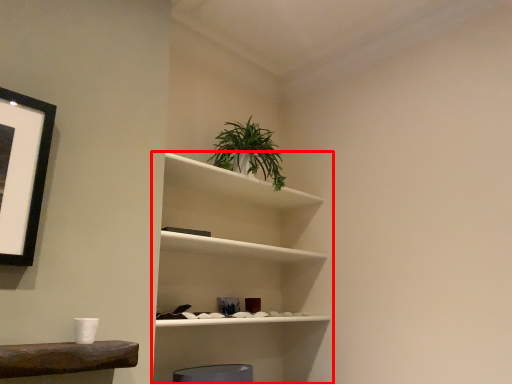
Question: From the image's perspective, considering the relative positions of shelf (annotated by the red box) and houseplant in the image provided, where is shelf (annotated by the red box) located with respect to the staircase?

Choices:
 (A) below
 (B) above

Answer: (A)